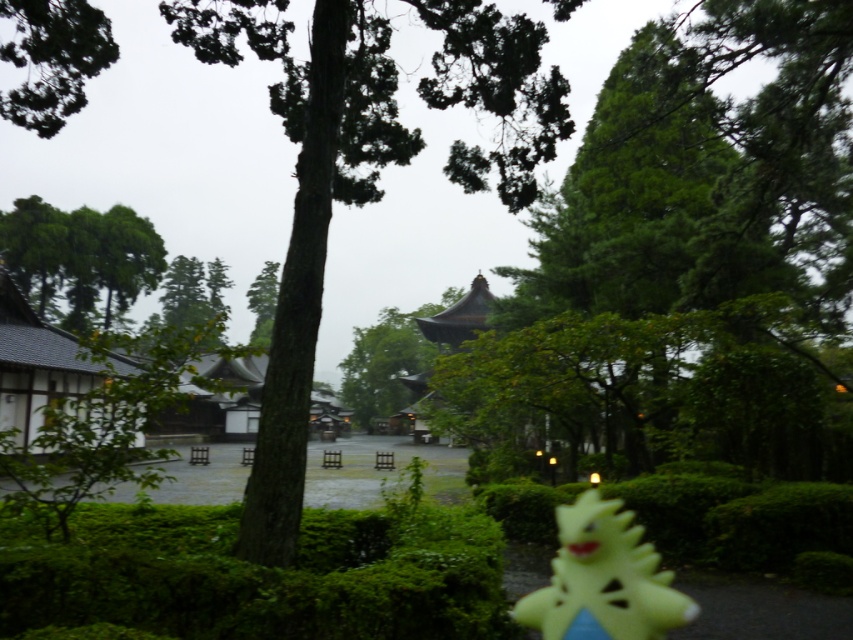
You are standing at the entrance of the traditional Japanese building and want to reach the point marked as point (67, 76). Which direction should you walk relative to the point (131, 598)?

To reach point (67, 76), you should walk towards the direction behind point (131, 598) since point (67, 76) is located behind point (131, 598) according to their spatial relationship.

You are a tourist visiting the Japanese garden and want to take a photo of the green leafy tree at center and the yellow rubber duck at lower right together in the same frame. Given that your camera has a maximum focus range of 30 meters, will you be able to capture both objects in focus?

The green leafy tree at center is 35.93 meters away from the yellow rubber duck at lower right. Since the distance exceeds the camera maximum focus range of 30 meters, you cannot capture both objects in focus.

You are a visitor in the Japanese garden and want to place a small statue between the green mossy hedge at lower left and the yellow rubber duck at lower right. What is the minimum distance the statue should be able to occupy to fit between them?

The green mossy hedge at lower left and yellow rubber duck at lower right are 1.51 meters apart, so the statue needs to be less than or equal to 1.51 meters in length to fit between them.